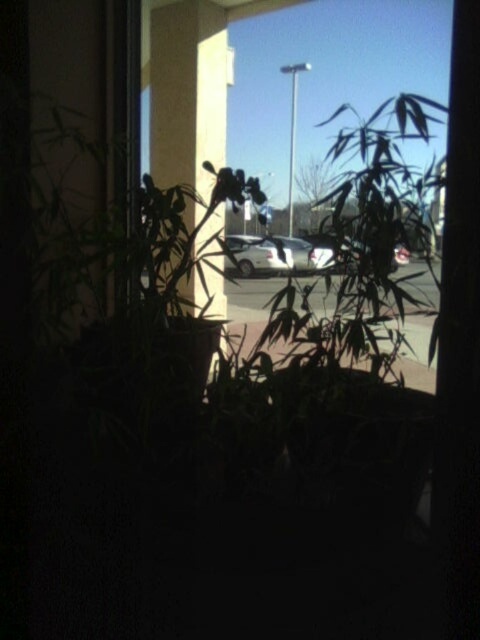
Question: Among these points, which one is nearest to the camera?

Choices:
 (A) (326, 266)
 (B) (276, 253)

Answer: (A)

Question: Can you confirm if satin silver car at center is thinner than white matte car at center?

Choices:
 (A) yes
 (B) no

Answer: (B)

Question: Can you confirm if satin silver car at center is smaller than white matte car at center?

Choices:
 (A) no
 (B) yes

Answer: (A)

Question: Which point is closer to the camera?

Choices:
 (A) satin silver car at center
 (B) white matte car at center

Answer: (B)

Question: Does satin silver car at center appear over white matte car at center?

Choices:
 (A) no
 (B) yes

Answer: (B)